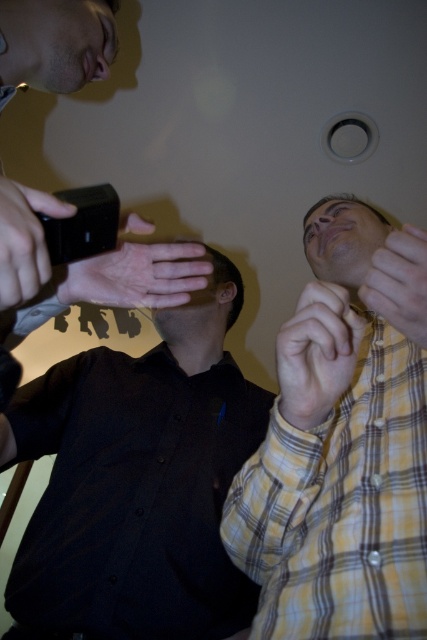
You are a photographer trying to capture a group photo. You see the black matte shirt at left and the yellow plaid shirt at lower right. Which person should you move to the right to center them in the frame?

You should move the yellow plaid shirt at lower right to the right to center them in the frame because the black matte shirt at left is already on the left side, so shifting the yellow plaid shirt at lower right further right would balance their positions.

You are a photographer trying to frame a group shot. You notice the black matte shirt at left and the yellow plaid shirt at lower right in your viewfinder. Which person should you adjust to make the composition more balanced in terms of width?

The black matte shirt at left is wider than the yellow plaid shirt at lower right, so you should adjust the yellow plaid shirt at lower right to spread out more to match the width of the black matte shirt at left.